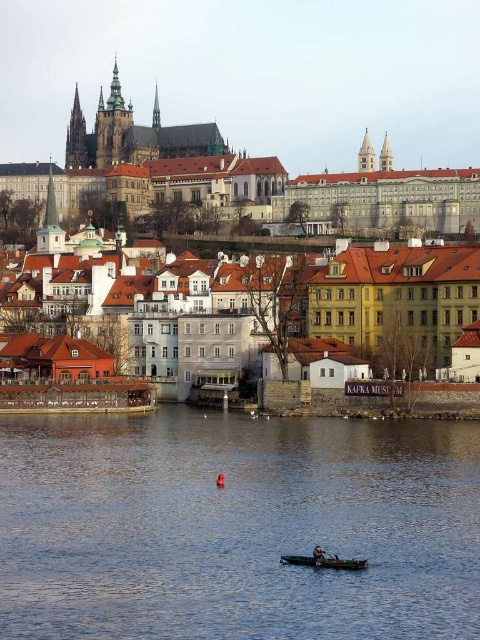
You are planning to take a short trip on the river and want to choose between the wooden canoe at lower center and the dark blue fabric boat at lower center. Which one do you think can carry more passengers?

The wooden canoe at lower center might be wider than dark blue fabric boat at lower center, so it can carry more passengers.

You are standing on the wooden canoe at lower center in the riverside scene. Looking towards the dark brown stone castle at upper center, which direction should you paddle to reach it?

The dark brown stone castle at upper center is located above the wooden canoe at lower center, so you should paddle upwards to reach it.